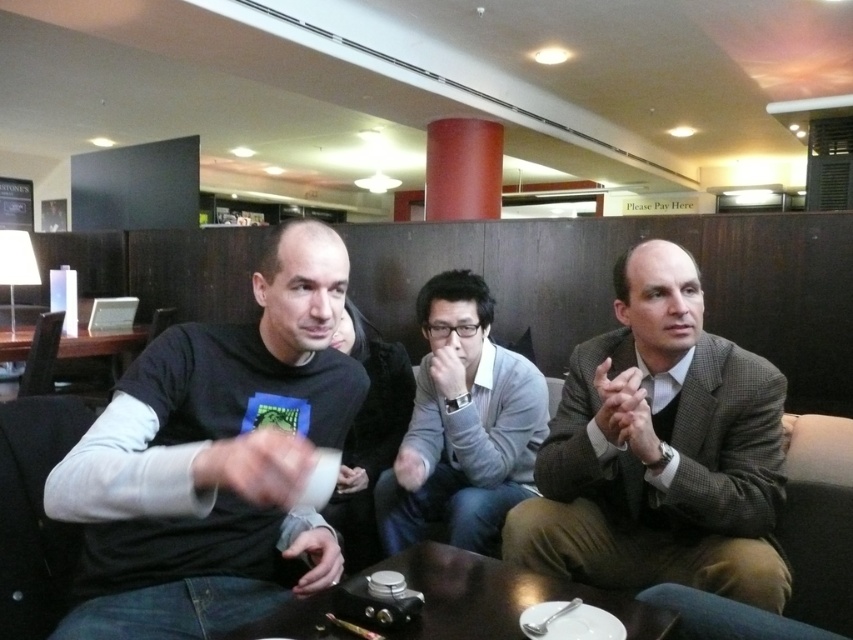
You are a barista trying to place a new order on the shiny dark wood table at center without covering the gray matte sweater at center. Can you fit the order on the table?

The gray matte sweater at center is bigger than the shiny dark wood table at center, so the sweater already occupies most of the table. The order cannot be placed without overlapping the sweater.

You are a barista who needs to place a hot beverage on the shiny dark wood table at center. However, you notice the black matte shirt at center is above it. Can you safely place the drink there without spilling?

The black matte shirt at center is located above the shiny dark wood table at center, so placing the drink there might cause it to spill since the shirt is blocking the area.